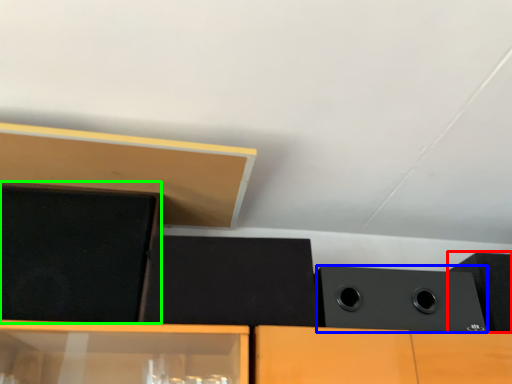
Question: Which is farther away from speaker (highlighted by a red box)? speaker (highlighted by a blue box) or speaker (highlighted by a green box)?

Choices:
 (A) speaker
 (B) speaker

Answer: (B)